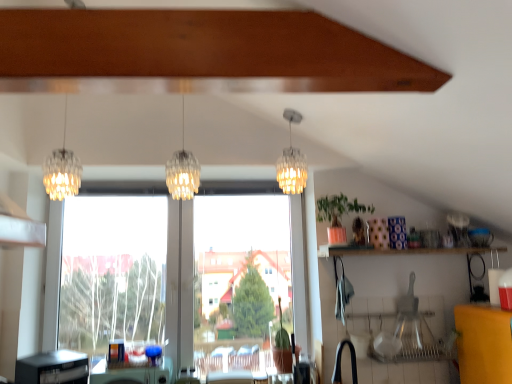
Question: Is point (167, 377) positioned closer to the camera than point (64, 377)?

Choices:
 (A) closer
 (B) farther

Answer: (B)

Question: From a real-world perspective, relative to black plastic dishwasher at lower left, is green plastic table at lower center vertically above or below?

Choices:
 (A) below
 (B) above

Answer: (A)

Question: Which of these objects is positioned farthest from the translucent glass pendant light at center, acting as the 2th lamp starting from the left?

Choices:
 (A) black rubber faucet at lower center
 (B) transparent glass window at center
 (C) clear glass chandelier at center, positioned as the 3th lamp in left-to-right order
 (D) green plastic table at lower center
 (E) translucent glass chandelier at left, the 1th lamp from the left

Answer: (A)

Question: Which object is positioned farthest from the black rubber faucet at lower center?

Choices:
 (A) clear glass chandelier at center, the first lamp in the right-to-left sequence
 (B) translucent glass chandelier at left, the 1th lamp from the left
 (C) green matte plant at upper right
 (D) translucent glass pendant light at center, acting as the 2th lamp starting from the left
 (E) green plastic table at lower center

Answer: (B)